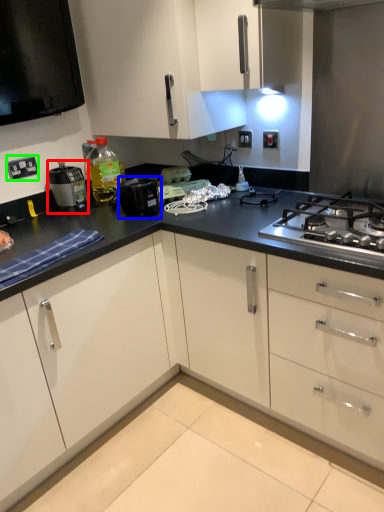
Question: Which is nearer to the home appliance (highlighted by a red box)? kitchen appliance (highlighted by a blue box) or electric outlet (highlighted by a green box).

Choices:
 (A) kitchen appliance
 (B) electric outlet

Answer: (B)